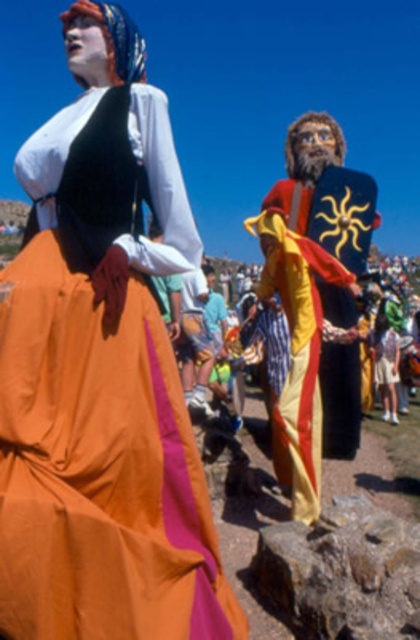
Question: Which of these objects is positioned farthest from the matte orange skirt at center?

Choices:
 (A) brown rough rock at lower center
 (B) yellow satin robe at center

Answer: (B)

Question: Does matte orange skirt at center appear on the left side of brown rough rock at lower center?

Choices:
 (A) no
 (B) yes

Answer: (B)

Question: Considering the relative positions of matte orange skirt at center and yellow satin robe at center in the image provided, where is matte orange skirt at center located with respect to yellow satin robe at center?

Choices:
 (A) above
 (B) below

Answer: (B)

Question: Considering the relative positions of matte orange skirt at center and brown rough rock at lower center in the image provided, where is matte orange skirt at center located with respect to brown rough rock at lower center?

Choices:
 (A) right
 (B) left

Answer: (B)

Question: Among these points, which one is farthest from the camera?

Choices:
 (A) (307, 432)
 (B) (307, 589)
 (C) (68, 266)

Answer: (A)

Question: Which of these objects is positioned farthest from the matte orange skirt at center?

Choices:
 (A) yellow satin robe at center
 (B) brown rough rock at lower center

Answer: (A)